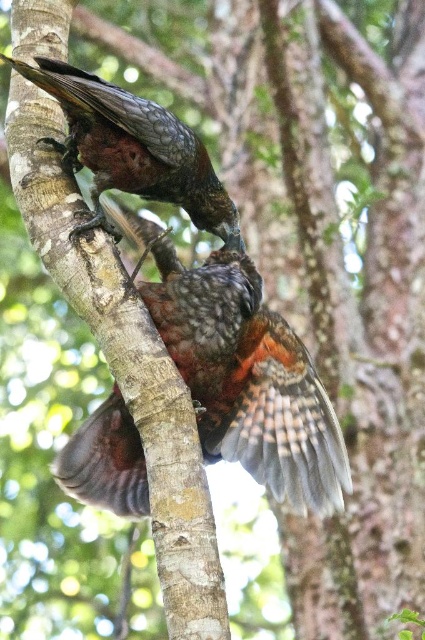
You are a birdwatcher observing two birds with shiny brown feathers. You notice one set of shiny brown feathers at center and another at shiny brown feathers at upper center. Which of these two is positioned lower on the tree branch?

The shiny brown feathers at center is located below the shiny brown feathers at upper center, so it is positioned lower on the tree branch.